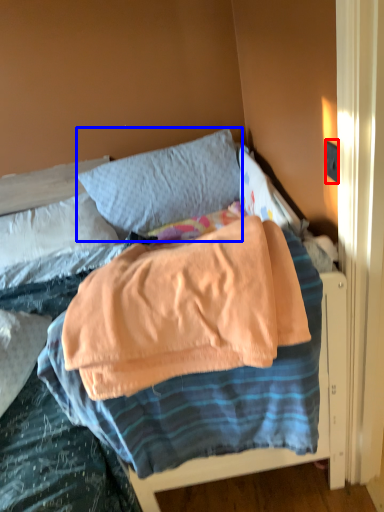
Question: Which point is further to the camera, electric outlet (highlighted by a red box) or pillow (highlighted by a blue box)?

Choices:
 (A) electric outlet
 (B) pillow

Answer: (B)